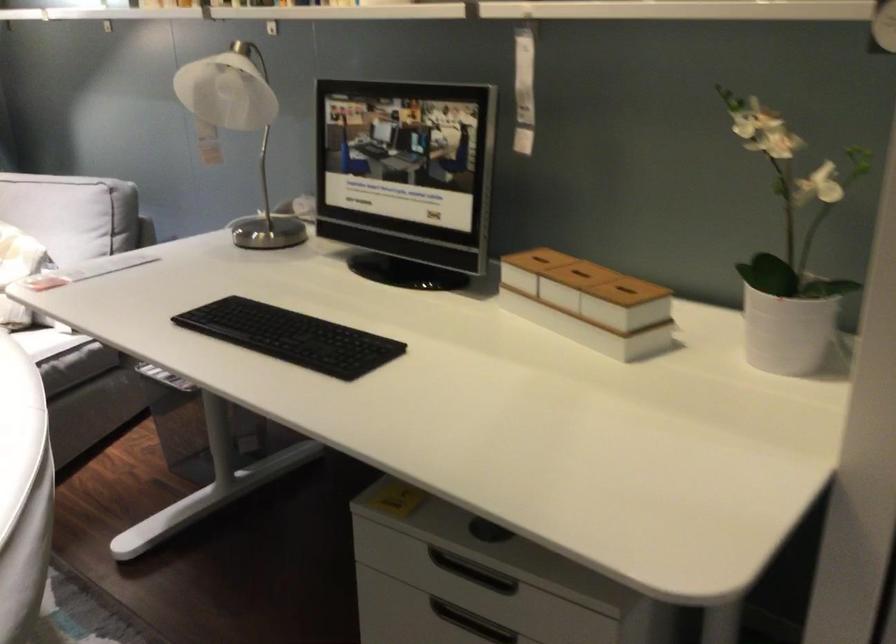
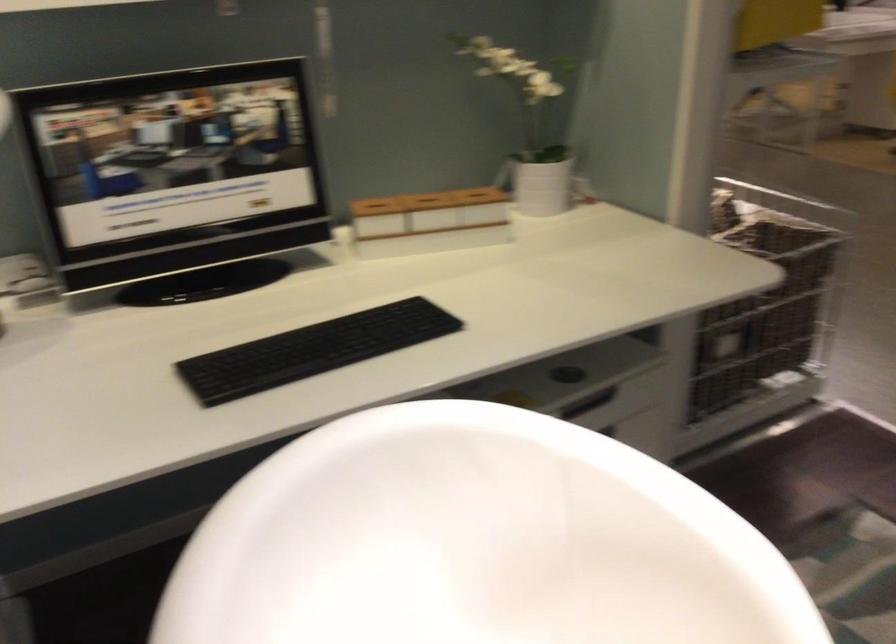
Find the pixel in the second image that matches point (579, 269) in the first image.

(426, 198)